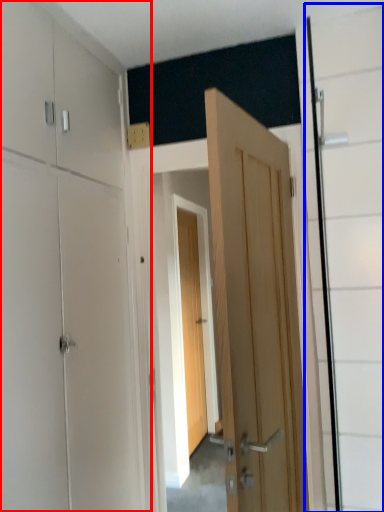
Question: Which of the following is the farthest to the observer, dresser (highlighted by a red box) or glass door (highlighted by a blue box)?

Choices:
 (A) dresser
 (B) glass door

Answer: (B)